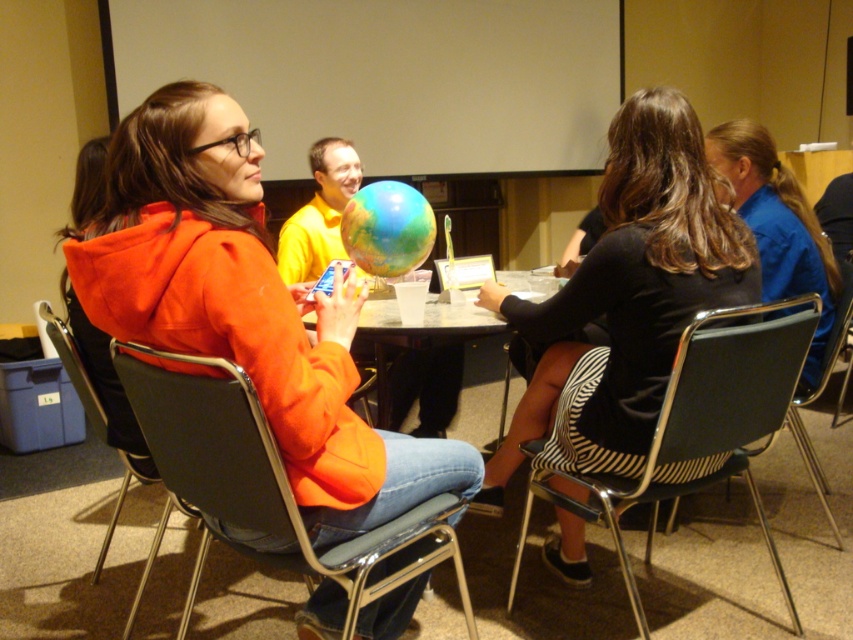
Is blue fabric shirt at right closer to the viewer compared to black plastic chair at center?

That is True.

What do you see at coordinates (778, 227) in the screenshot? I see `blue fabric shirt at right` at bounding box center [778, 227].

Where is `blue fabric shirt at right`? blue fabric shirt at right is located at coordinates (778, 227).

Does metallic gray chair at center appear over black fabric chair at center?

Incorrect, metallic gray chair at center is not positioned above black fabric chair at center.

Consider the image. Which of these two, metallic gray chair at center or black fabric chair at center, stands shorter?

With less height is metallic gray chair at center.

Locate an element on the screen. metallic gray chair at center is located at coordinates (262, 474).

Describe the element at coordinates (247, 308) in the screenshot. The height and width of the screenshot is (640, 853). I see `orange matte jacket at center` at that location.

Where is `orange matte jacket at center`? The height and width of the screenshot is (640, 853). orange matte jacket at center is located at coordinates (247, 308).